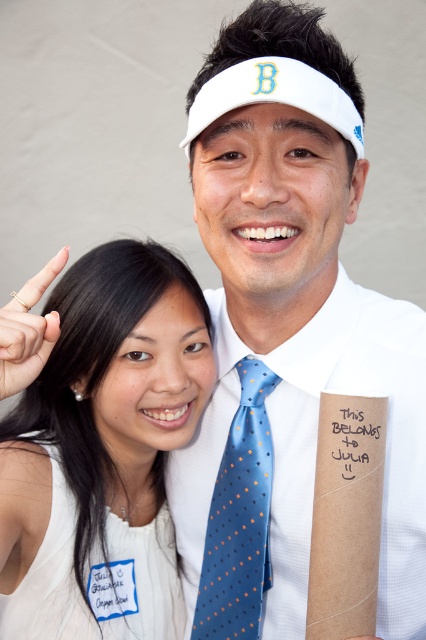
Question: Which is nearer to the white fabric dress at lower left?

Choices:
 (A) white paper at upper center
 (B) blue silk tie at center

Answer: (B)

Question: Which object is positioned farthest from the blue silk tie at center?

Choices:
 (A) white fabric dress at lower left
 (B) gold metallic ring at upper left

Answer: (B)

Question: Which object is closer to the camera taking this photo?

Choices:
 (A) white paper at upper center
 (B) white fabric dress at lower left

Answer: (A)

Question: Is white fabric dress at lower left wider than blue silk tie at center?

Choices:
 (A) yes
 (B) no

Answer: (A)

Question: Can you confirm if white fabric dress at lower left is positioned to the right of white paper at upper center?

Choices:
 (A) yes
 (B) no

Answer: (B)

Question: Is white fabric dress at lower left positioned before white paper at upper center?

Choices:
 (A) yes
 (B) no

Answer: (B)